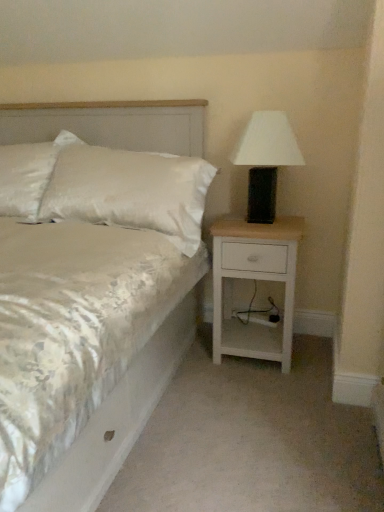
Question: Would you consider satin white pillow at upper left to be distant from white wood nightstand at right?

Choices:
 (A) yes
 (B) no

Answer: (B)

Question: Is satin white pillow at upper left thinner than white wood nightstand at right?

Choices:
 (A) no
 (B) yes

Answer: (B)

Question: Does satin white pillow at upper left have a greater height compared to white wood nightstand at right?

Choices:
 (A) yes
 (B) no

Answer: (A)

Question: Would you say satin white pillow at upper left is outside white wood nightstand at right?

Choices:
 (A) yes
 (B) no

Answer: (A)

Question: Does satin white pillow at upper left come in front of white wood nightstand at right?

Choices:
 (A) no
 (B) yes

Answer: (A)

Question: Is satin white pillow at upper left to the left or to the right of white satin bed at center in the image?

Choices:
 (A) left
 (B) right

Answer: (A)

Question: Is satin white pillow at upper left inside the boundaries of white satin bed at center, or outside?

Choices:
 (A) outside
 (B) inside

Answer: (B)

Question: Looking at the image, does satin white pillow at upper left seem bigger or smaller compared to white satin bed at center?

Choices:
 (A) small
 (B) big

Answer: (A)

Question: From their relative heights in the image, would you say satin white pillow at upper left is taller or shorter than white satin bed at center?

Choices:
 (A) short
 (B) tall

Answer: (A)

Question: Is satin white pillow at upper left to the left or to the right of white wood nightstand at right in the image?

Choices:
 (A) left
 (B) right

Answer: (A)

Question: Is satin white pillow at upper left in front of or behind white wood nightstand at right in the image?

Choices:
 (A) behind
 (B) front

Answer: (A)

Question: Considering the positions of satin white pillow at upper left and white wood nightstand at right in the image, is satin white pillow at upper left taller or shorter than white wood nightstand at right?

Choices:
 (A) tall
 (B) short

Answer: (A)

Question: From the image's perspective, is satin white pillow at upper left above or below white wood nightstand at right?

Choices:
 (A) below
 (B) above

Answer: (B)

Question: Considering the relative positions of satin white pillow at upper left and white matte table lamp at right in the image provided, is satin white pillow at upper left to the left or to the right of white matte table lamp at right?

Choices:
 (A) left
 (B) right

Answer: (A)

Question: From the image's perspective, is satin white pillow at upper left located above or below white matte table lamp at right?

Choices:
 (A) below
 (B) above

Answer: (B)